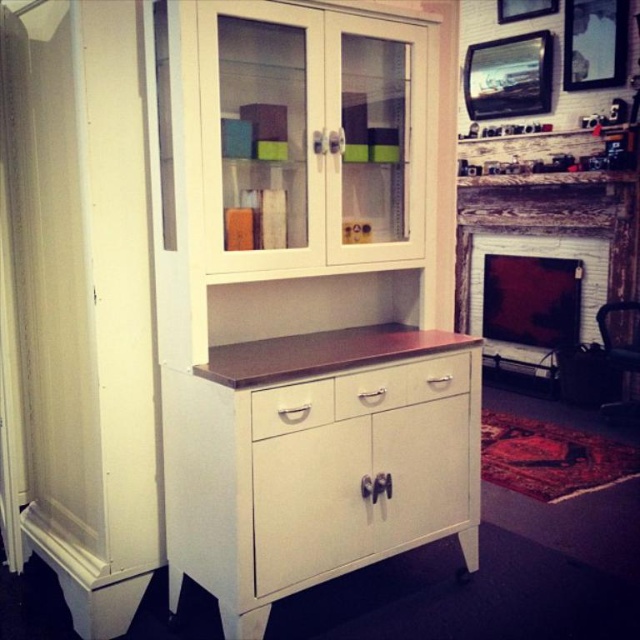
Question: Can you confirm if white brick fireplace at center is positioned to the right of satin white drawer at center?

Choices:
 (A) no
 (B) yes

Answer: (B)

Question: Which point is closer to the camera?

Choices:
 (A) white wood dresser at center
 (B) white brick fireplace at center
 (C) satin white drawer at center
 (D) white matte drawer at center

Answer: (A)

Question: Which of the following is the farthest from the observer?

Choices:
 (A) white matte drawer at center
 (B) white wood dresser at center
 (C) satin white drawer at center

Answer: (C)

Question: Which of the following is the farthest from the observer?

Choices:
 (A) white brick fireplace at center
 (B) white wood dresser at center
 (C) white matte drawer at center

Answer: (A)

Question: Does white matte drawer at center have a greater width compared to satin white drawer at center?

Choices:
 (A) no
 (B) yes

Answer: (A)

Question: In this image, where is white wood dresser at center located relative to satin white drawer at center?

Choices:
 (A) below
 (B) above

Answer: (A)